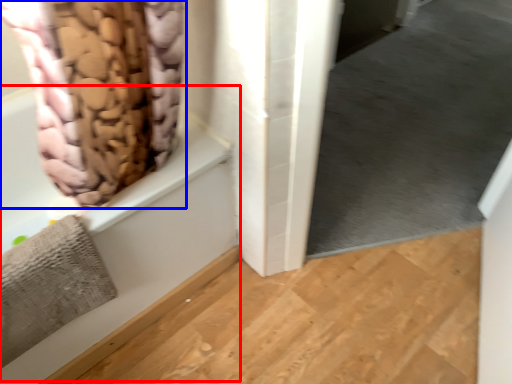
Question: Which point is closer to the camera, bath (highlighted by a red box) or curtain (highlighted by a blue box)?

Choices:
 (A) bath
 (B) curtain

Answer: (B)